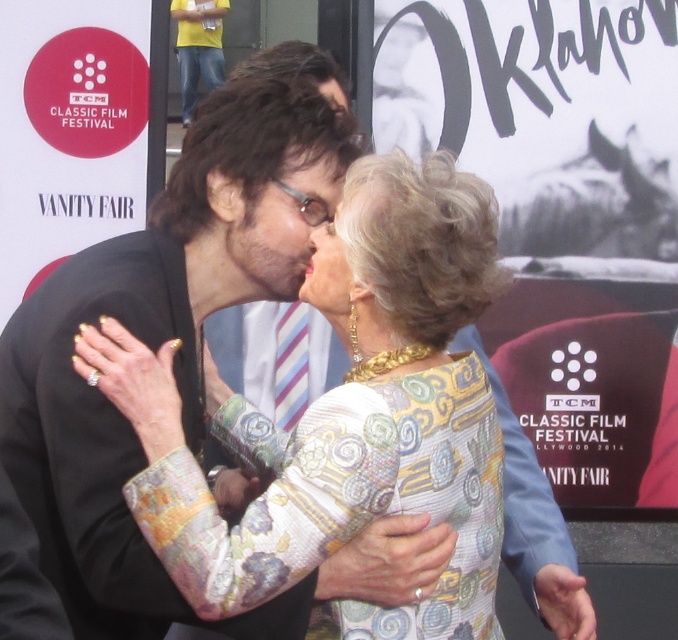
Question: Which object is the farthest from the matte black face at center?

Choices:
 (A) black paper at upper center
 (B) yellow t-shirt at upper left

Answer: (B)

Question: Does black paper at upper center appear on the left side of matte black hair at center?

Choices:
 (A) yes
 (B) no

Answer: (B)

Question: Can you confirm if black paper at upper center is positioned above matte black face at center?

Choices:
 (A) yes
 (B) no

Answer: (A)

Question: Which of the following is the closest to the observer?

Choices:
 (A) (319, 83)
 (B) (191, 99)
 (C) (266, 268)
 (D) (342, 308)

Answer: (D)

Question: Does black paper at upper center lie behind matte black face at center?

Choices:
 (A) yes
 (B) no

Answer: (A)

Question: Which object is the farthest from the yellow t-shirt at upper left?

Choices:
 (A) matte black hair at center
 (B) black paper at upper center
 (C) matte gold necklace at center

Answer: (C)